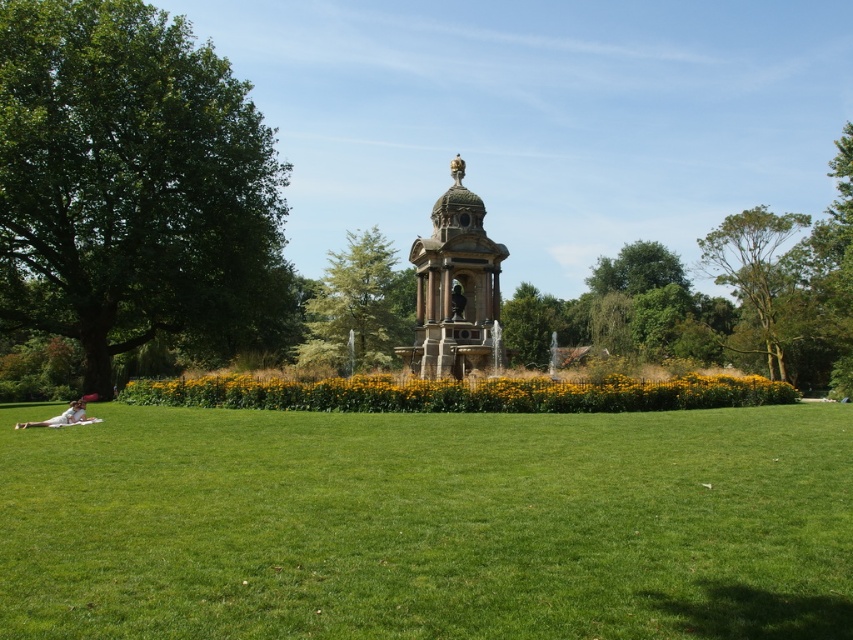
You are standing at the point labeled as point (358, 305) in the park scene. What object is directly in front of you?

The green leafy tree at center is directly in front of you at point (358, 305).

You are planning to install a new bench in the park. The bench requires a space of 5 meters between the two green leafy trees to be placed safely. Based on the scene, is the distance between the green leafy tree at center and the green leafy tree at upper right sufficient for placing the bench?

The green leafy tree at center and the green leafy tree at upper right are 47.67 meters apart from each other. Since the required space is only 5 meters, the distance is more than enough to safely place the bench between them.

You are standing in the park and see the green leafy tree at center and the white fabric person at lower left. Which object is closer to you?

The white fabric person at lower left is behind the green leafy tree at center, so the green leafy tree at center is closer to you.